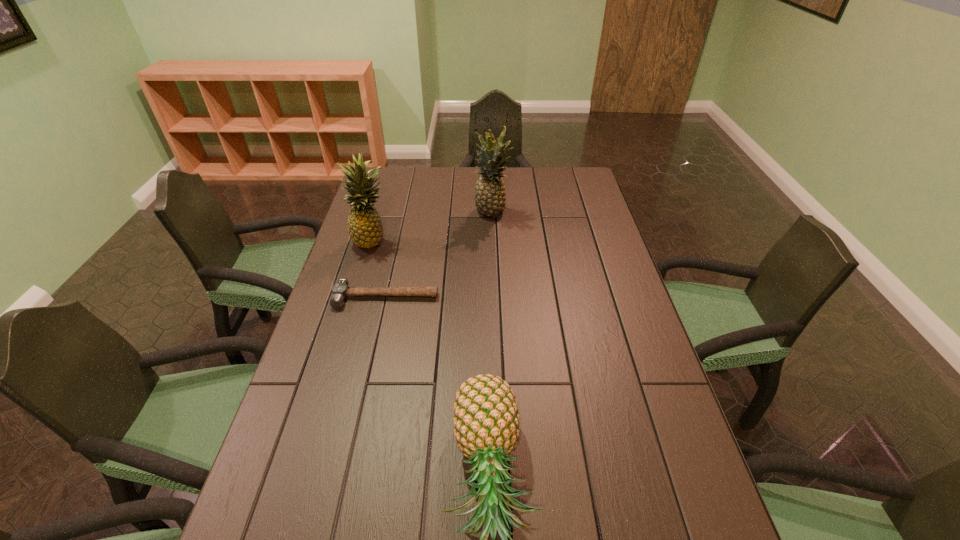
The image size is (960, 540). Identify the location of pineapple that is the third closest to the shortest object. (490, 197).